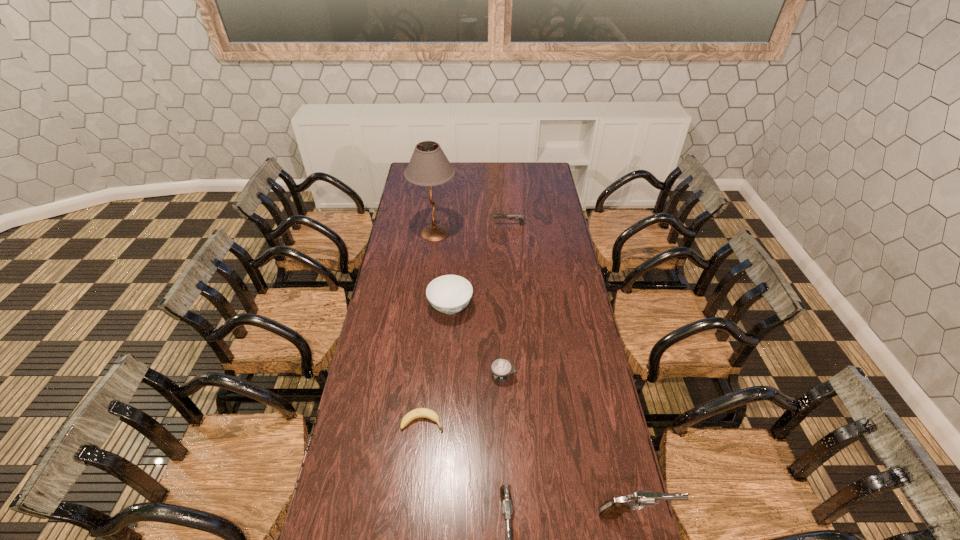
Image resolution: width=960 pixels, height=540 pixels. I want to click on vacant space located 0.290m at the muzzle end of the gun, so click(x=438, y=225).

You are a GUI agent. You are given a task and a screenshot of the screen. Output one action in this format:
    pyautogui.click(x=<x>, y=<y>)
    Task: Click on the vacant region located 0.150m at the muzzle end of the gun
    The height and width of the screenshot is (540, 960).
    Given the screenshot: What is the action you would take?
    pyautogui.click(x=465, y=225)

What are the coordinates of `free space located 0.320m at the muzzle end of the gun` in the screenshot? It's located at [432, 225].

At what (x,y) coordinates should I click in order to perform the action: click on vacant space located on the front-facing side of the tallest object. Please return your answer as a coordinate pair (x, y). Looking at the image, I should click on (487, 233).

Where is `vacant space located 0.310m at the stem of the shortest object`? This screenshot has width=960, height=540. vacant space located 0.310m at the stem of the shortest object is located at coordinates (535, 422).

At what (x,y) coordinates should I click in order to perform the action: click on vacant space located on the front of the second shortest object. Please return your answer as a coordinate pair (x, y). Image resolution: width=960 pixels, height=540 pixels. Looking at the image, I should click on (505, 422).

I want to click on free space located 0.170m on the left of the chinaware, so (x=389, y=307).

At what (x,y) coordinates should I click in order to perform the action: click on object present at the near edge. Please return your answer as a coordinate pair (x, y). Looking at the image, I should click on (611, 509).

Where is `object that is at the left edge`? The image size is (960, 540). object that is at the left edge is located at coordinates (429, 166).

This screenshot has width=960, height=540. I want to click on object that is at the right edge, so click(611, 509).